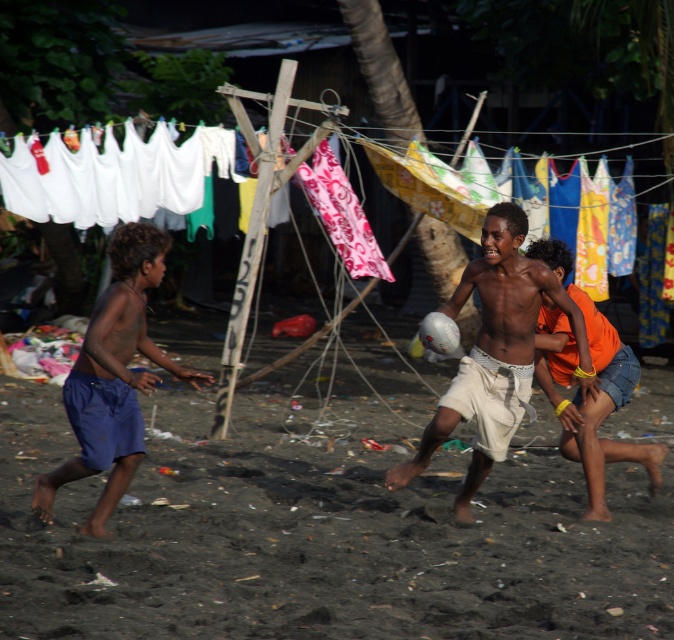
Which is behind, point (468, 636) or point (572, 410)?

The point (572, 410) is behind.

This screenshot has height=640, width=674. Find the location of `dark brown sand at center`. dark brown sand at center is located at coordinates (321, 528).

Who is lower down, dark brown sand at center or white cotton shorts at center?

dark brown sand at center is lower down.

Is dark brown sand at center smaller than white cotton shorts at center?

Yes.

Find the location of a particular element. This screenshot has width=674, height=640. dark brown sand at center is located at coordinates (321, 528).

Is dark brown sand at center behind blue cotton shorts at left?

No, dark brown sand at center is closer to the viewer.

Does dark brown sand at center appear on the left side of blue cotton shorts at left?

No, dark brown sand at center is not to the left of blue cotton shorts at left.

Between point (615, 497) and point (148, 234), which one is positioned behind?

Point (615, 497)

You are a GUI agent. You are given a task and a screenshot of the screen. Output one action in this format:
    pyautogui.click(x=<x>, y=<y>)
    Task: Click on the dark brown sand at center
    
    Given the screenshot: What is the action you would take?
    pyautogui.click(x=321, y=528)